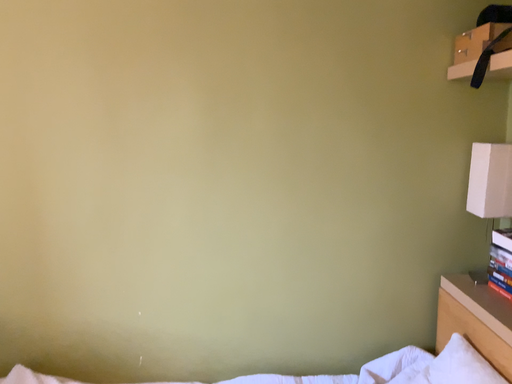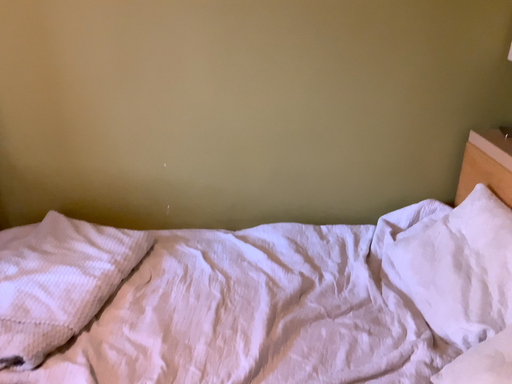
Question: How did the camera likely rotate when shooting the video?

Choices:
 (A) rotated downward
 (B) rotated upward

Answer: (A)